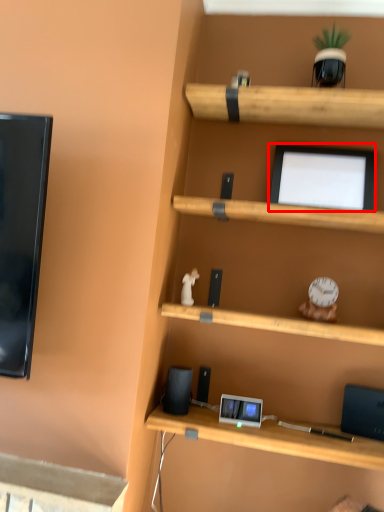
Question: From the image's perspective, considering the relative positions of computer monitor (annotated by the red box) and speaker in the image provided, where is computer monitor (annotated by the red box) located with respect to the staircase?

Choices:
 (A) above
 (B) below

Answer: (A)